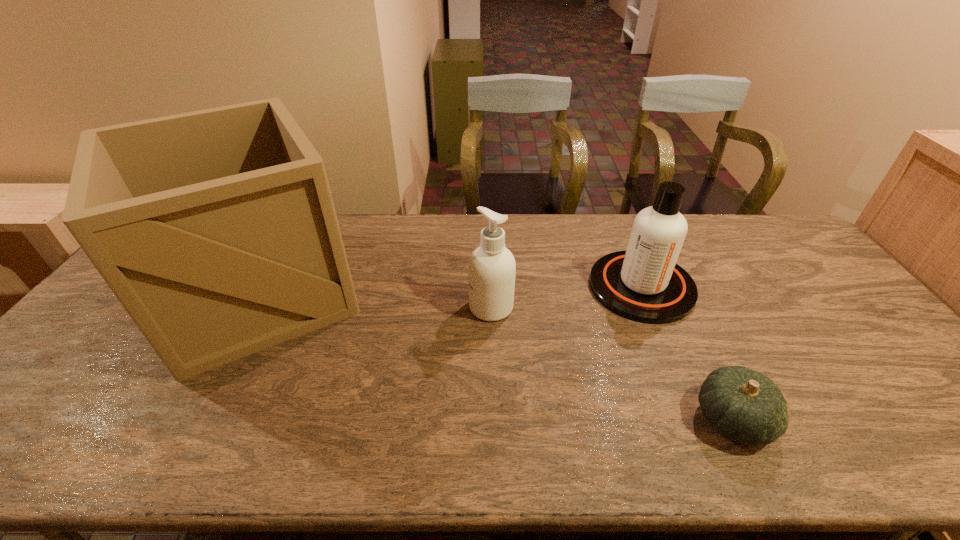
At what (x,y) coordinates should I click in order to perform the action: click on the leftmost object. Please return your answer as a coordinate pair (x, y). Looking at the image, I should click on (216, 230).

I want to click on the tallest object, so click(216, 230).

Where is `the right cleansing agent`? the right cleansing agent is located at coordinates (644, 284).

Locate an element on the screen. The width and height of the screenshot is (960, 540). the left cleansing agent is located at coordinates (491, 270).

The width and height of the screenshot is (960, 540). Find the location of `gourd`. gourd is located at coordinates (743, 405).

The image size is (960, 540). What are the coordinates of `the nearest object` in the screenshot? It's located at (743, 405).

At what (x,y) coordinates should I click in order to perform the action: click on vacant space located on the right of the leftmost object. Please return your answer as a coordinate pair (x, y). Looking at the image, I should click on (439, 293).

The width and height of the screenshot is (960, 540). Find the location of `vacant region located on the right of the right cleansing agent`. vacant region located on the right of the right cleansing agent is located at coordinates (795, 287).

The height and width of the screenshot is (540, 960). I want to click on free space located on the front label of the third object from right to left, so tap(368, 307).

Find the location of a particular element. This screenshot has width=960, height=540. vacant space located on the front label of the third object from right to left is located at coordinates (357, 307).